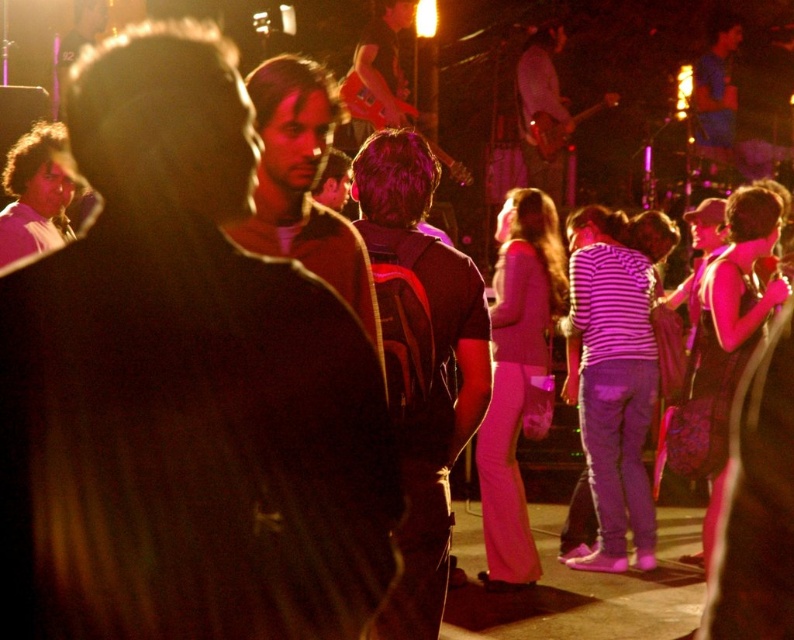
You are at a concert and want to take a photo of the person wearing the matte black shirt at center and the person with dark brown hair at center. Which one should you focus on first to ensure both are in sharp focus?

You should focus on the matte black shirt at center first because it is closer to the viewer than the dark brown hair at center. By focusing on the closer object, the farther one may still be in acceptable focus depending on the depth of field.

You are at a concert venue and want to find the matte black shirt at center. According to the coordinates given, where should you look?

The matte black shirt at center is located at coordinates point (x=182, y=387).